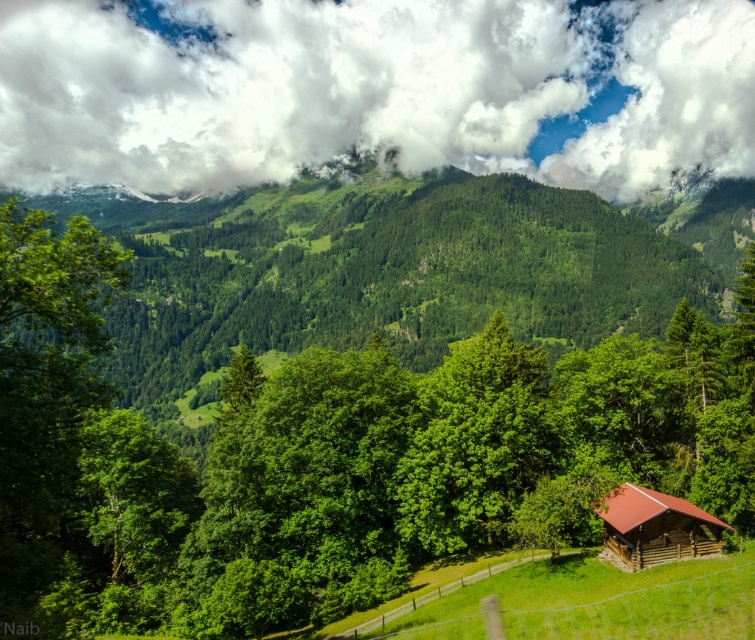
Question: Does green leafy tree at center appear under white fluffy cloud at upper center?

Choices:
 (A) yes
 (B) no

Answer: (A)

Question: Among these points, which one is nearest to the camera?

Choices:
 (A) (618, 529)
 (B) (495, 464)

Answer: (A)

Question: Does green leafy tree at center appear on the left side of brown wooden cabin at center-right?

Choices:
 (A) yes
 (B) no

Answer: (A)

Question: Which of the following is the farthest from the observer?

Choices:
 (A) (609, 540)
 (B) (76, 86)
 (C) (396, 209)

Answer: (B)

Question: From the image, what is the correct spatial relationship of green leafy tree at center in relation to brown wooden cabin at center-right?

Choices:
 (A) above
 (B) below

Answer: (A)

Question: Among these points, which one is farthest from the camera?

Choices:
 (A) coord(371,225)
 (B) coord(535,4)
 (C) coord(626,484)

Answer: (B)